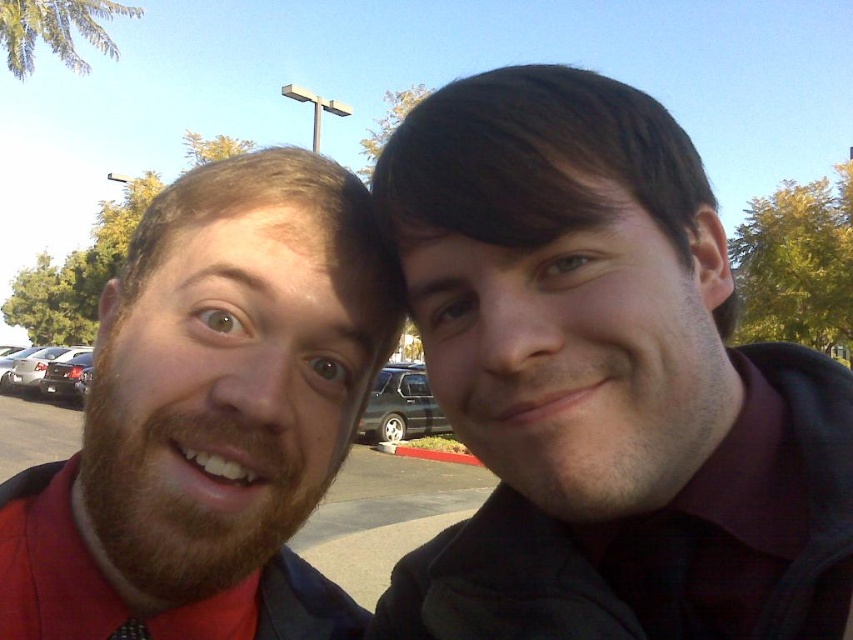
You are a photographer trying to capture a photo of the two people in the image. Since both the shiny black car at left and the silver metallic sedan at left are in the background, which car should you focus on if you want the taller vehicle to be clearly visible in the background?

The shiny black car at left is taller than the silver metallic sedan at left, so focusing on the shiny black car at left will ensure the taller vehicle is clearly visible in the background.

You are standing in a parking lot and see two cars on your left side. The shiny black car at left and the silver metallic sedan at left. Which car is nearer to you?

The shiny black car at left is closer to the viewer than the silver metallic sedan at left, so the shiny black car at left is nearer to you.

You are a photographer adjusting the framing of a photo. You need to ensure that the matte black jacket at upper right and the black satin tie at lower left are both visible in the frame. Given their distance apart, can you confirm if they can both fit within a standard smartphone camera frame that has a 60 inch diagonal field of view?

The matte black jacket at upper right and the black satin tie at lower left are 21.54 inches apart. Since the smartphone camera frame has a 60 inch diagonal field of view, which is significantly larger than the distance between them, both objects can easily fit within the frame.